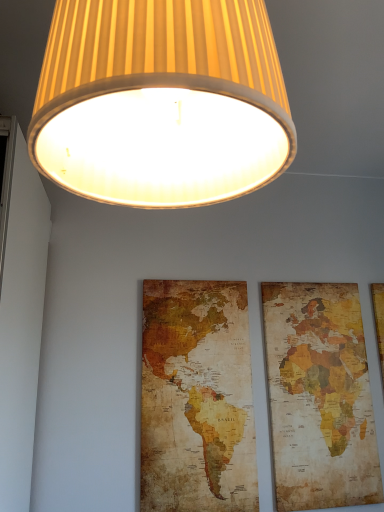
Question: Can you confirm if matte yellow fabric lampshade at upper center is thinner than vintage paper map at center?

Choices:
 (A) yes
 (B) no

Answer: (B)

Question: Is matte yellow fabric lampshade at upper center outside of vintage paper map at center?

Choices:
 (A) yes
 (B) no

Answer: (A)

Question: Would you say vintage paper map at center is part of matte yellow fabric lampshade at upper center's contents?

Choices:
 (A) yes
 (B) no

Answer: (B)

Question: Is matte yellow fabric lampshade at upper center at the left side of vintage paper map at center?

Choices:
 (A) yes
 (B) no

Answer: (A)

Question: From a real-world perspective, is matte yellow fabric lampshade at upper center under vintage paper map at center?

Choices:
 (A) no
 (B) yes

Answer: (A)

Question: Choose the correct answer: Is matte yellow fabric lampshade at upper center inside vintage paper map at right or outside it?

Choices:
 (A) inside
 (B) outside

Answer: (B)

Question: From the image's perspective, relative to vintage paper map at right, is matte yellow fabric lampshade at upper center above or below?

Choices:
 (A) above
 (B) below

Answer: (A)

Question: From a real-world perspective, is matte yellow fabric lampshade at upper center above or below vintage paper map at right?

Choices:
 (A) below
 (B) above

Answer: (B)

Question: Is matte yellow fabric lampshade at upper center taller or shorter than vintage paper map at right?

Choices:
 (A) tall
 (B) short

Answer: (B)

Question: Relative to matte yellow fabric lampshade at upper center, is vintage paper map at right in front or behind?

Choices:
 (A) behind
 (B) front

Answer: (A)

Question: Considering the relative positions of vintage paper map at right and matte yellow fabric lampshade at upper center in the image provided, is vintage paper map at right to the left or to the right of matte yellow fabric lampshade at upper center?

Choices:
 (A) right
 (B) left

Answer: (A)

Question: Is point (309, 345) closer or farther from the camera than point (92, 53)?

Choices:
 (A) closer
 (B) farther

Answer: (B)

Question: From the image's perspective, is vintage paper map at right positioned above or below matte yellow fabric lampshade at upper center?

Choices:
 (A) below
 (B) above

Answer: (A)

Question: In the image, is vintage paper map at center positioned in front of or behind vintage paper map at right?

Choices:
 (A) behind
 (B) front

Answer: (B)

Question: Considering the positions of vintage paper map at center and vintage paper map at right in the image, is vintage paper map at center bigger or smaller than vintage paper map at right?

Choices:
 (A) small
 (B) big

Answer: (B)